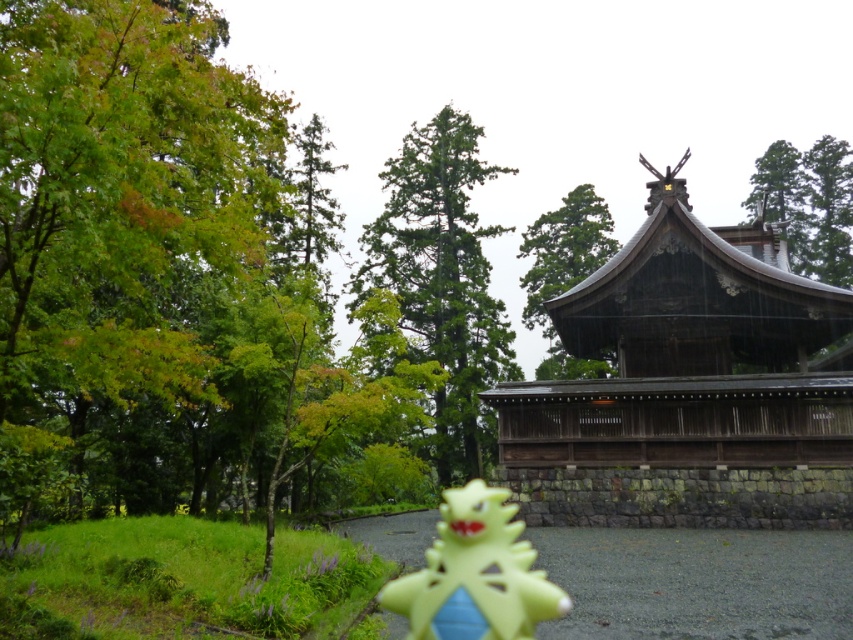
Question: Considering the real-world distances, which object is closest to the green wood tree at upper center?

Choices:
 (A) green textured tree at upper center
 (B) green textured tree at center
 (C) green leafy tree at left
 (D) yellow plastic toy at center

Answer: (B)

Question: Which point appears farthest from the camera in this image?

Choices:
 (A) (808, 342)
 (B) (276, 163)

Answer: (B)

Question: Can you confirm if green textured tree at center is positioned below yellow plastic toy at center?

Choices:
 (A) no
 (B) yes

Answer: (A)

Question: Which of the following is the closest to the observer?

Choices:
 (A) green textured tree at upper center
 (B) green wood tree at upper center
 (C) green leafy tree at left
 (D) dark brown wooden pagoda at center

Answer: (C)

Question: Is green leafy tree at left bigger than dark brown wooden pagoda at center?

Choices:
 (A) no
 (B) yes

Answer: (B)

Question: Where is green leafy tree at left located in relation to green textured tree at upper center in the image?

Choices:
 (A) above
 (B) below

Answer: (B)